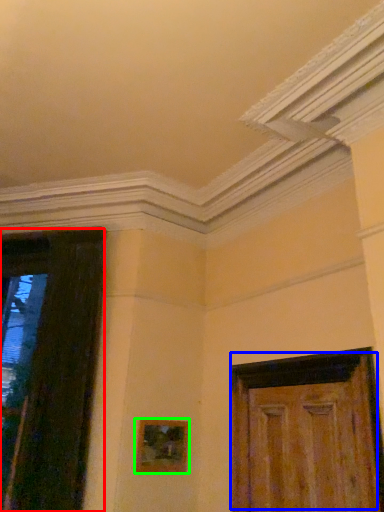
Question: Based on their relative distances, which object is nearer to door (highlighted by a red box)? Choose from door (highlighted by a blue box) and picture frame (highlighted by a green box).

Choices:
 (A) door
 (B) picture frame

Answer: (B)